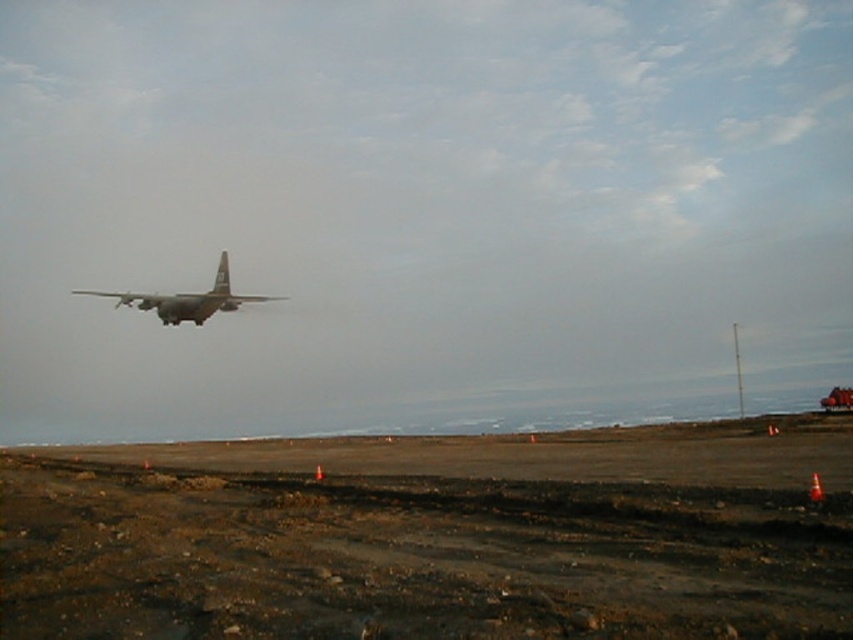
Question: Which object appears farthest from the camera in this image?

Choices:
 (A) brown dirt field at lower center
 (B) camouflage fabric airplane at upper center
 (C) brown dirt track at lower center

Answer: (B)

Question: Is brown dirt track at lower center below brown dirt field at lower center?

Choices:
 (A) no
 (B) yes

Answer: (A)

Question: Which object appears closest to the camera in this image?

Choices:
 (A) camouflage fabric airplane at upper center
 (B) brown dirt track at lower center

Answer: (B)

Question: Is brown dirt track at lower center to the right of camouflage fabric airplane at upper center from the viewer's perspective?

Choices:
 (A) no
 (B) yes

Answer: (B)

Question: Among these objects, which one is farthest from the camera?

Choices:
 (A) brown dirt track at lower center
 (B) camouflage fabric airplane at upper center

Answer: (B)

Question: Is brown dirt track at lower center wider than camouflage fabric airplane at upper center?

Choices:
 (A) no
 (B) yes

Answer: (B)